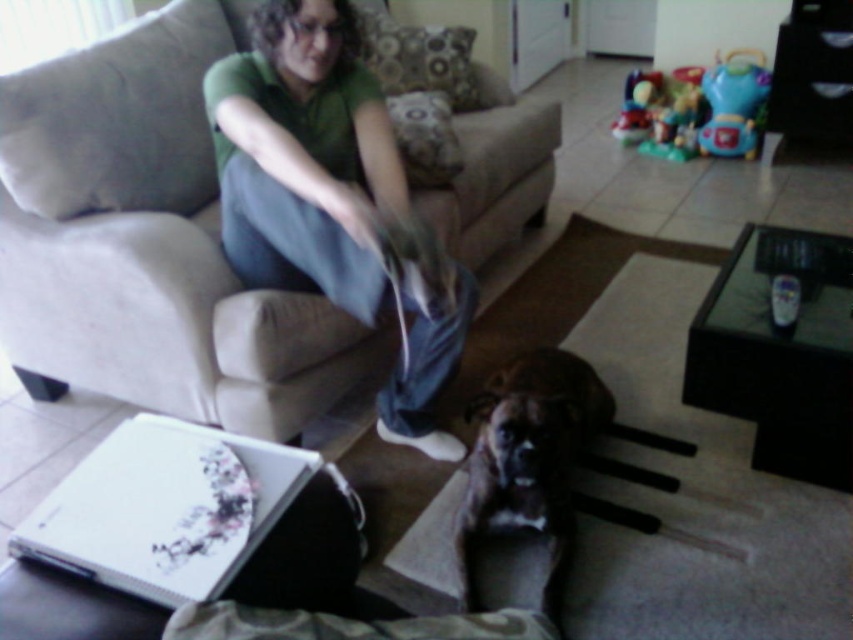
You are a guest entering the living room and want to sit down on the beige fabric couch at center. Which side of the brown furry dog at center should you walk around to reach the couch?

The beige fabric couch at center is to the left of the brown furry dog at center, so you should walk around the left side of the brown furry dog at center to reach the couch.

You are a delivery robot that needs to place a package between the green cotton shirt at center and the brown furry dog at center. The package is 12 inches long. Can you fit it in the space between them?

The green cotton shirt at center is 16.88 inches away from the brown furry dog at center. Since the package is 12 inches long, it can fit in the space between them as there is enough space.